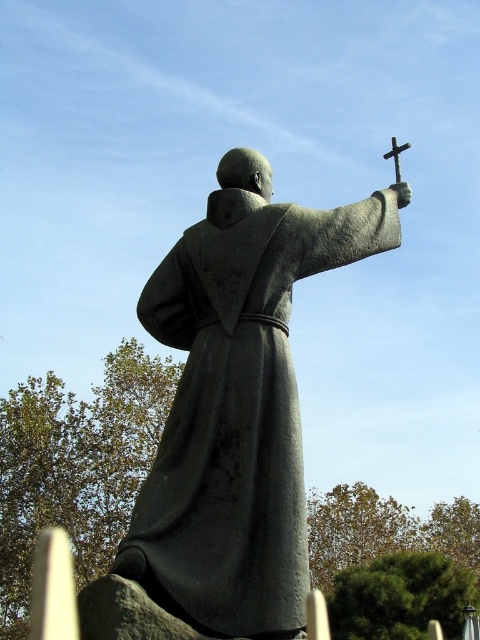
Question: Which point is closer to the camera taking this photo?

Choices:
 (A) (396, 182)
 (B) (141, 557)

Answer: (B)

Question: Does gray stone statue at center have a larger size compared to polished silver cross at upper right?

Choices:
 (A) no
 (B) yes

Answer: (B)

Question: Among these points, which one is farthest from the camera?

Choices:
 (A) pos(395,140)
 (B) pos(263,525)

Answer: (A)

Question: Does gray stone statue at center appear on the right side of polished silver cross at upper right?

Choices:
 (A) yes
 (B) no

Answer: (B)

Question: Is gray stone statue at center further to the viewer compared to polished silver cross at upper right?

Choices:
 (A) yes
 (B) no

Answer: (B)